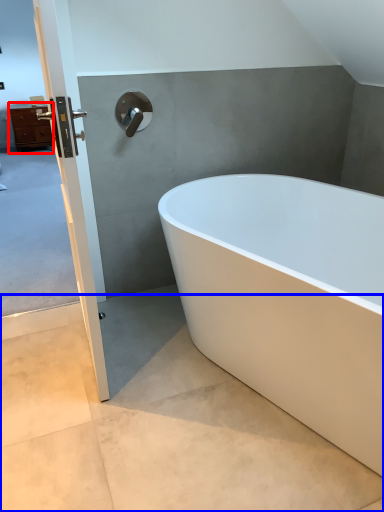
Question: Which object appears closest to the camera in this image, chest of drawers (highlighted by a red box) or concrete (highlighted by a blue box)?

Choices:
 (A) chest of drawers
 (B) concrete

Answer: (B)